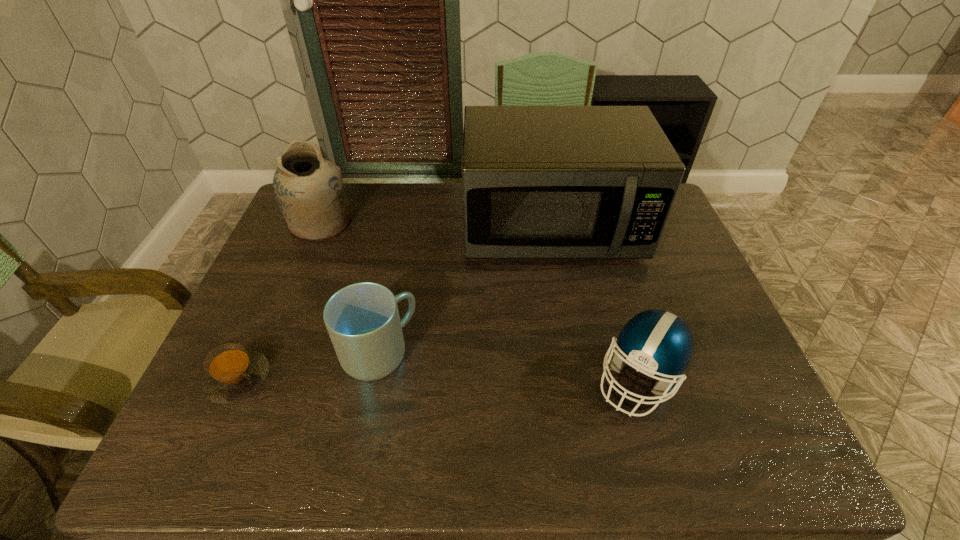
I want to click on object that ranks as the second closest to the microwave oven, so click(x=655, y=342).